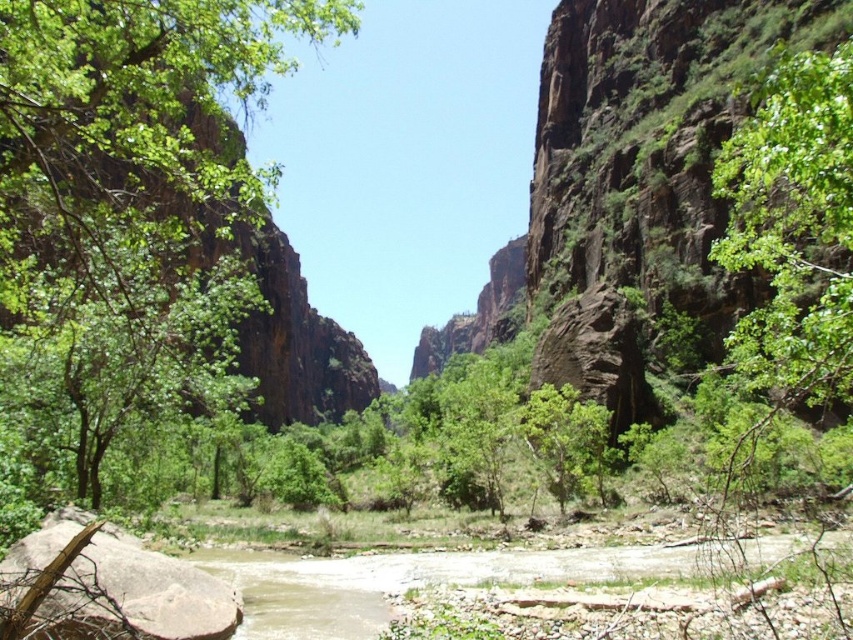
You are standing at the point with coordinates point (x=128, y=141) in the canyon. What can you see directly in front of you?

You can see a green leafy tree at left directly in front of you.

You are standing at the center of the riverbed in the image. Looking towards the cliffs, you notice a point marked at coordinates (793, 227). What object is located at that point?

The point at coordinates (793, 227) marks a green leafy tree at upper right.

You are standing at the point with coordinates point (840, 83) and want to reach the point with coordinates point (7, 602). Which direction should you move to get closer to your destination?

To move from point (840, 83) to point (7, 602), you should move towards the lower right direction since point (7, 602) is located to the lower right of point (840, 83).